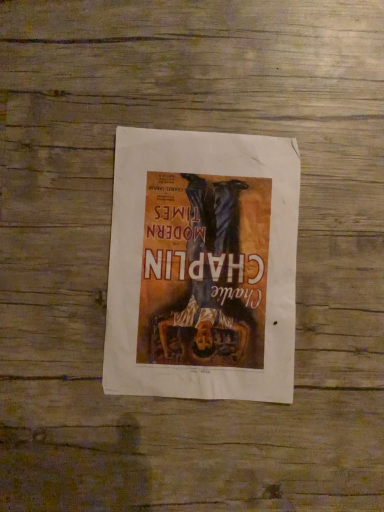
Image resolution: width=384 pixels, height=512 pixels. In order to click on matte paper poster at center in this screenshot , I will do click(202, 266).

The image size is (384, 512). What do you see at coordinates (202, 266) in the screenshot?
I see `matte paper poster at center` at bounding box center [202, 266].

In order to click on matte paper poster at center in this screenshot , I will do `click(202, 266)`.